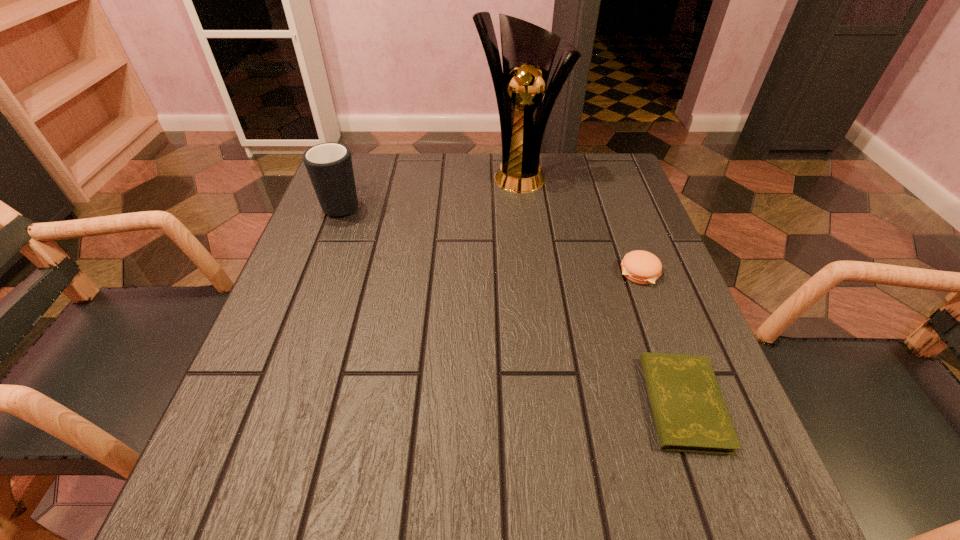
Where is `the third object from right to left`? Image resolution: width=960 pixels, height=540 pixels. the third object from right to left is located at coordinates (528, 51).

Where is `award`? award is located at coordinates (528, 51).

The width and height of the screenshot is (960, 540). I want to click on the leftmost object, so click(329, 165).

The width and height of the screenshot is (960, 540). Identify the location of the second tallest object. (329, 165).

Identify the location of patty. The width and height of the screenshot is (960, 540). (641, 267).

The width and height of the screenshot is (960, 540). I want to click on the third farthest object, so click(x=641, y=267).

At what (x,y) coordinates should I click in order to perform the action: click on the nearest object. Please return your answer as a coordinate pair (x, y). Looking at the image, I should click on (690, 414).

At what (x,y) coordinates should I click in order to perform the action: click on diary. Please return your answer as a coordinate pair (x, y). The height and width of the screenshot is (540, 960). Looking at the image, I should click on (690, 414).

The image size is (960, 540). In order to click on vacant space located at the front of the third object from right to left, where the globe is visible in this screenshot , I will do `click(527, 254)`.

Locate an element on the screen. free space located on the side of the third shortest object with the handle is located at coordinates (353, 176).